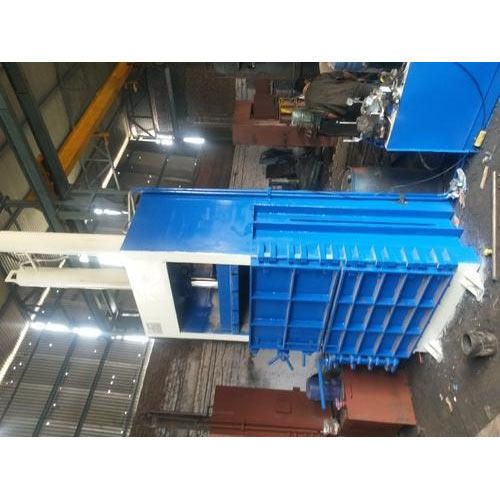
Locate an element on the screen. wall is located at coordinates (210, 108), (214, 167).